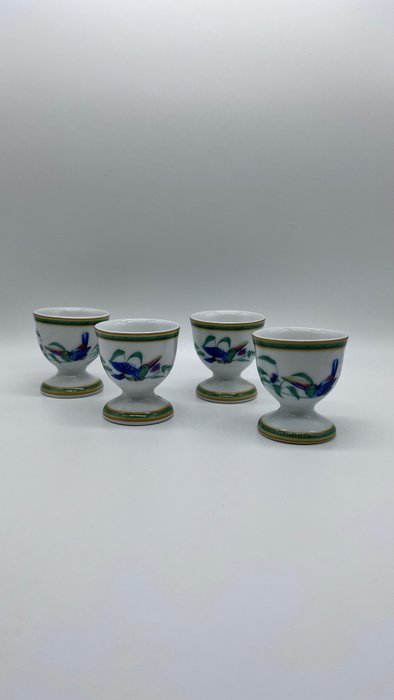
This screenshot has width=394, height=700. What are the coordinates of `ceramic` in the screenshot? It's located at coord(58,337), coord(149,354), coord(221,372), coord(300,409).